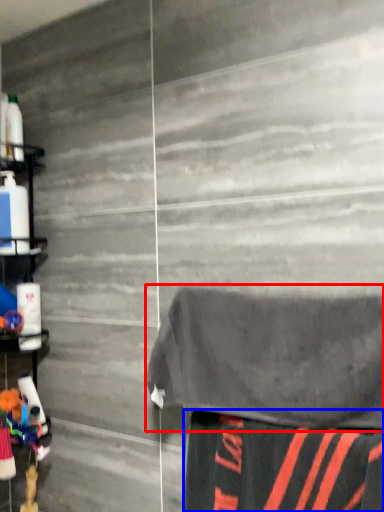
Question: Which point is closer to the camera, bath towel (highlighted by a red box) or fabric (highlighted by a blue box)?

Choices:
 (A) bath towel
 (B) fabric

Answer: (B)